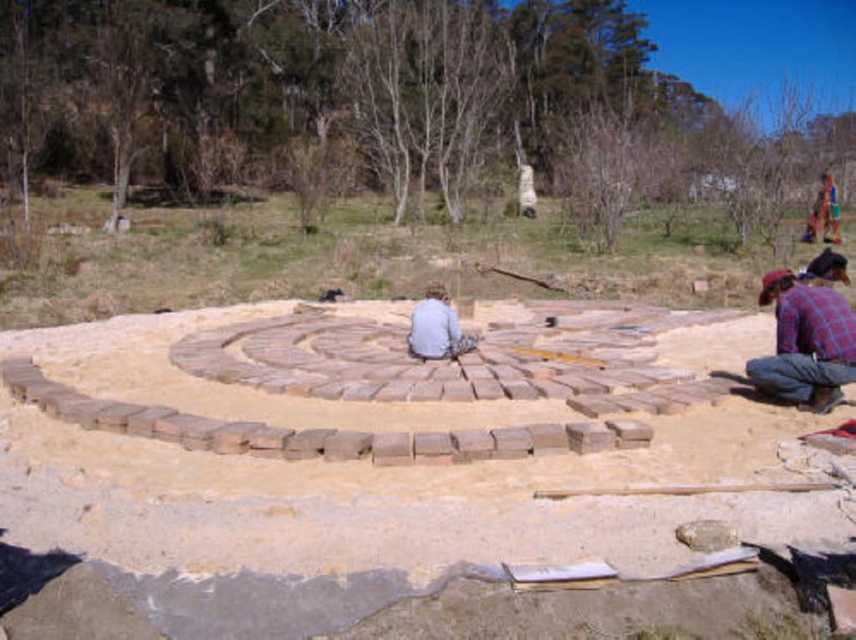
In the scene shown: Is brown brick maze at center bigger than plaid fabric shirt at lower right?

Indeed, brown brick maze at center has a larger size compared to plaid fabric shirt at lower right.

Does brown brick maze at center lie behind plaid fabric shirt at lower right?

No, brown brick maze at center is closer to the viewer.

This screenshot has height=640, width=856. Find the location of `brown brick maze at center`. brown brick maze at center is located at coordinates (363, 483).

Is brown brick maze at center shorter than light gray fabric at center?

In fact, brown brick maze at center may be taller than light gray fabric at center.

Is point (681, 390) positioned behind point (435, 337)?

That is False.

Where is `brown brick maze at center`? This screenshot has height=640, width=856. brown brick maze at center is located at coordinates (363, 483).

Which is behind, point (800, 312) or point (423, 326)?

Point (423, 326)

Which of these two, plaid fabric shirt at lower right or light gray fabric at center, stands taller?

With more height is plaid fabric shirt at lower right.

Between point (825, 355) and point (423, 330), which one is positioned in front?

Positioned in front is point (825, 355).

Find the location of a particular element. Image resolution: width=856 pixels, height=640 pixels. plaid fabric shirt at lower right is located at coordinates coord(805,342).